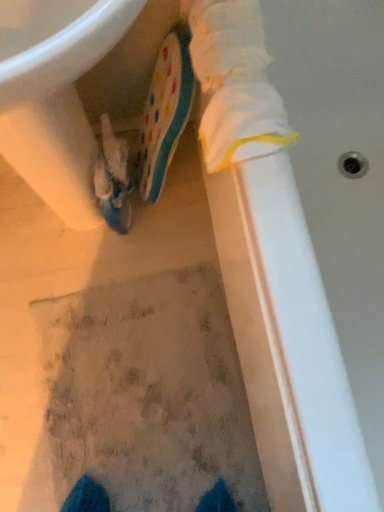
Question: From the image's perspective, is textured gray mat at center on polka dot rubber boot at center, which is counted as the 1th footwear, starting from the right?

Choices:
 (A) yes
 (B) no

Answer: (B)

Question: Could you tell me if textured gray mat at center is turned towards polka dot rubber boot at center, which is counted as the 1th footwear, starting from the right?

Choices:
 (A) yes
 (B) no

Answer: (B)

Question: Is textured gray mat at center smaller than polka dot rubber boot at center, the 2th footwear from the left?

Choices:
 (A) yes
 (B) no

Answer: (A)

Question: From the image's perspective, is textured gray mat at center beneath polka dot rubber boot at center, the 2th footwear from the left?

Choices:
 (A) yes
 (B) no

Answer: (A)

Question: Is polka dot rubber boot at center, which is counted as the 1th footwear, starting from the right, a part of textured gray mat at center?

Choices:
 (A) no
 (B) yes

Answer: (A)

Question: Is textured gray mat at center wider than polka dot rubber boot at center, the 2th footwear from the left?

Choices:
 (A) no
 (B) yes

Answer: (B)

Question: From a real-world perspective, is polka dot rubber boot at center, the 2th footwear from the left, positioned under textured gray mat at center based on gravity?

Choices:
 (A) no
 (B) yes

Answer: (A)

Question: Does polka dot rubber boot at center, the 2th footwear from the left, touch textured gray mat at center?

Choices:
 (A) yes
 (B) no

Answer: (B)

Question: Is polka dot rubber boot at center, the 2th footwear from the left, located outside textured gray mat at center?

Choices:
 (A) yes
 (B) no

Answer: (A)

Question: Is polka dot rubber boot at center, the 2th footwear from the left, thinner than textured gray mat at center?

Choices:
 (A) no
 (B) yes

Answer: (B)

Question: Is polka dot rubber boot at center, the 2th footwear from the left, positioned with its back to textured gray mat at center?

Choices:
 (A) no
 (B) yes

Answer: (A)

Question: Could you tell me if polka dot rubber boot at center, which is counted as the 1th footwear, starting from the right, is turned towards textured gray mat at center?

Choices:
 (A) no
 (B) yes

Answer: (A)

Question: Does textured gray mat at center have a lesser height compared to white glossy sink at upper left?

Choices:
 (A) no
 (B) yes

Answer: (B)